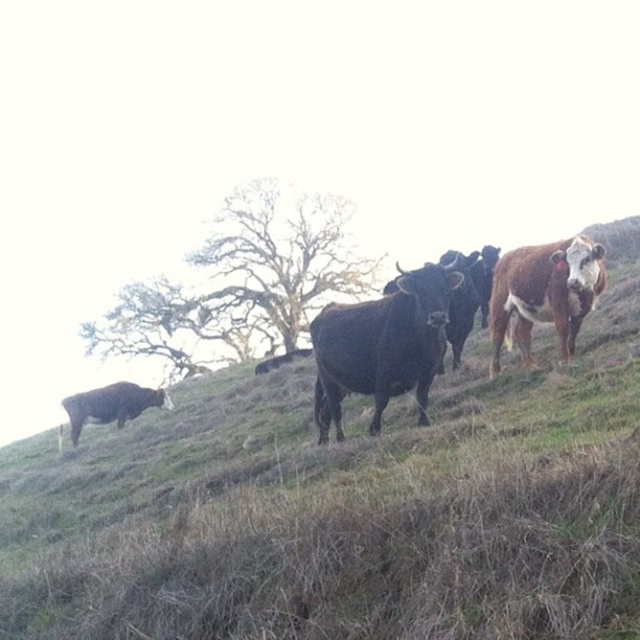
You are standing on the dry, brownish grass in the foreground of the image and want to reach the green grass at center. Which direction should you walk to get there?

You should walk towards the center of the image to reach the green grass at center, as it is located at point coordinates of (348, 506).

You are a farmer checking the health of your cattle. You notice the brown textured cow at right and the shiny brown bull at lower left. Which one is smaller in size?

The brown textured cow at right is smaller in size compared to the shiny brown bull at lower left.